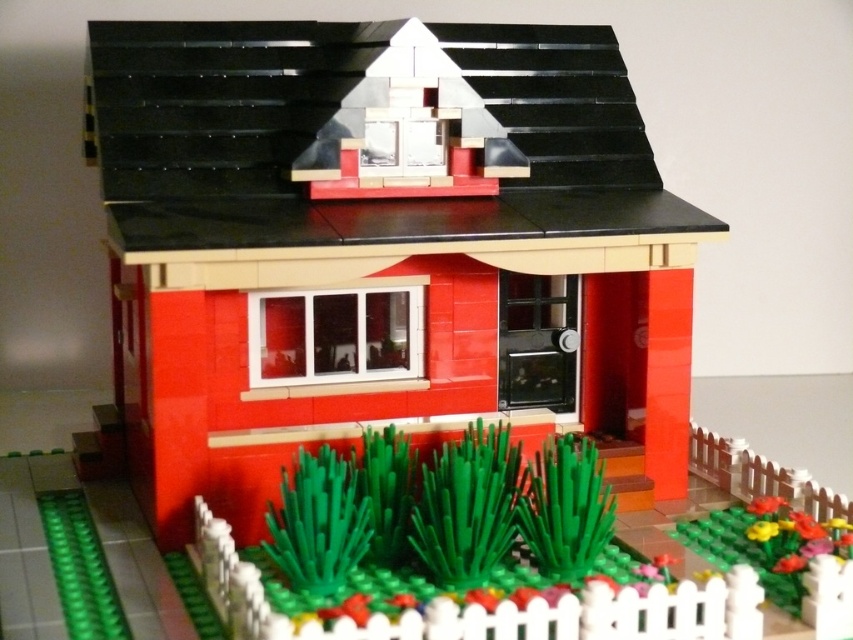
Describe the element at coordinates (373, 244) in the screenshot. Image resolution: width=853 pixels, height=640 pixels. I see `brick house at center` at that location.

Is point (677, 371) less distant than point (810, 525)?

That is False.

Which is behind, point (106, 52) or point (793, 611)?

Point (106, 52)

Find the location of a particular element. brick house at center is located at coordinates [373, 244].